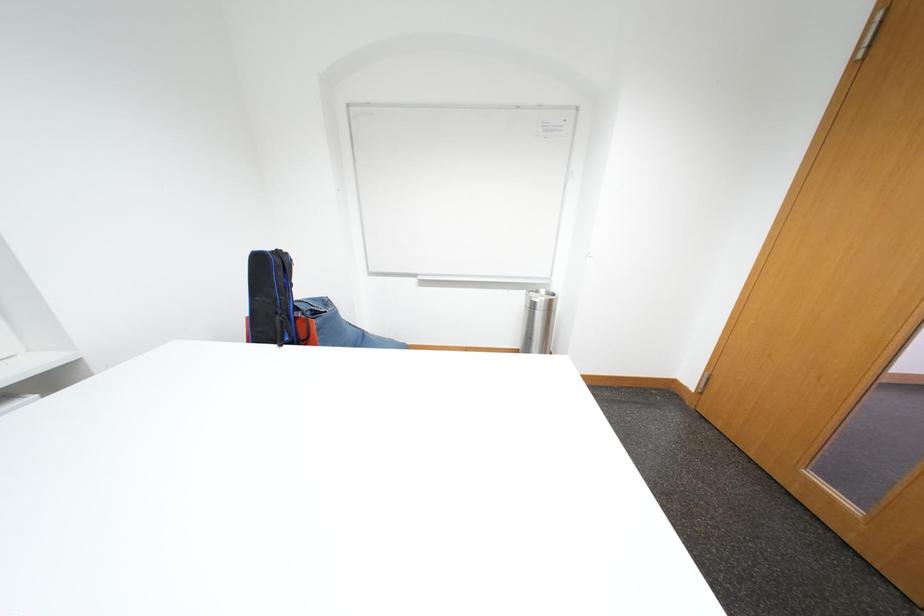
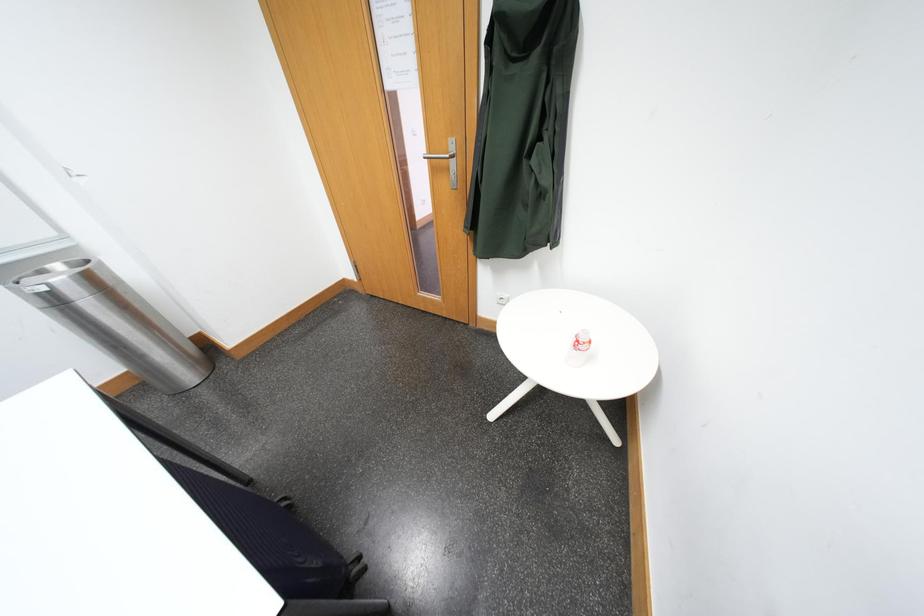
The first image is from the beginning of the video and the second image is from the end. How did the camera likely rotate when shooting the video?

The rotation direction of the camera is right-down.